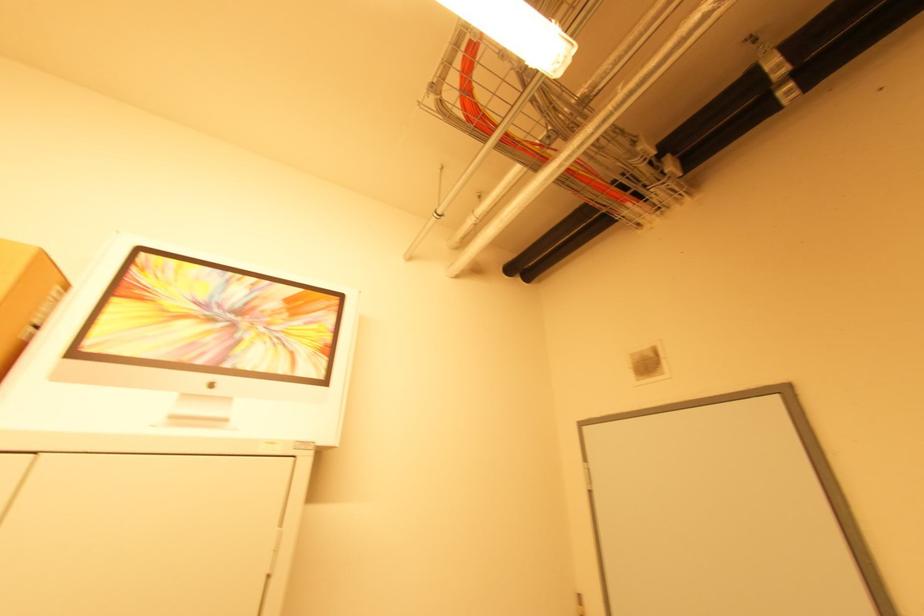
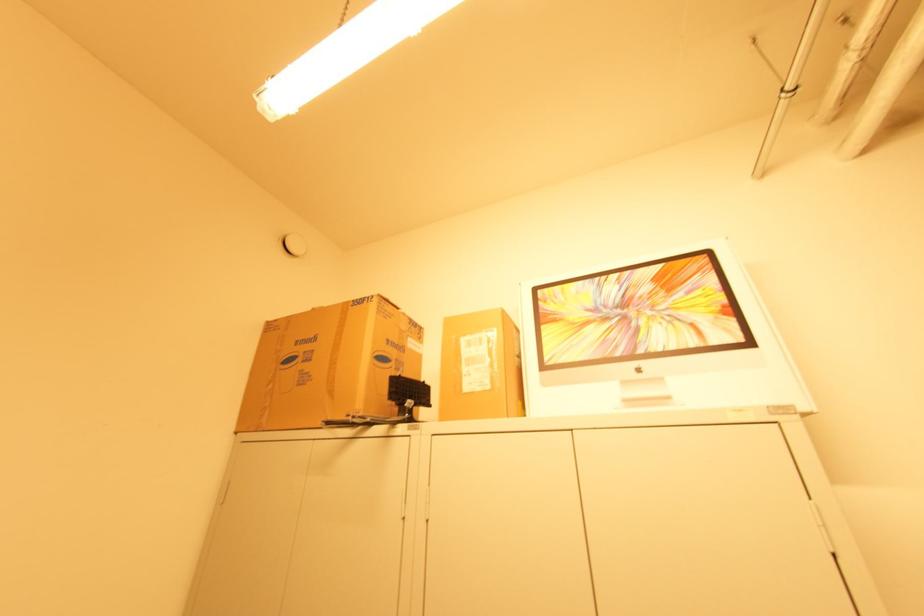
Locate, in the second image, the point that corresponds to (32,329) in the first image.

(520, 359)